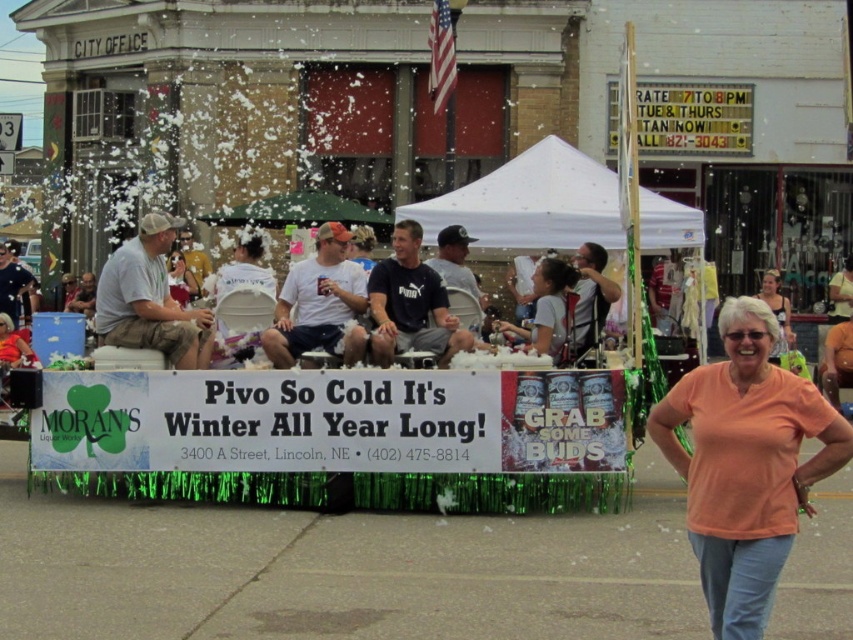
What is the exact location of the light brown cotton shirt at left on the float?

The light brown cotton shirt at left is located at point (149, 300).

In the scene shown: You are a photographer at the parade and want to capture both the matte orange shirt at center and the matte pink dress at center in a single photo. Which clothing item should you focus on to ensure both are in frame?

The matte orange shirt at center is much taller than the matte pink dress at center, so focusing on the taller matte orange shirt at center would help ensure both are visible in the photo.